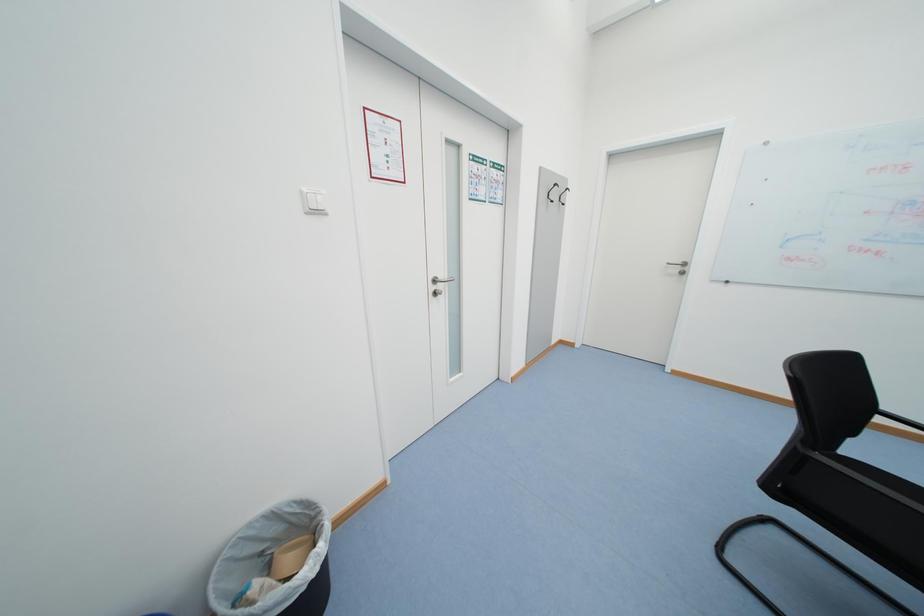
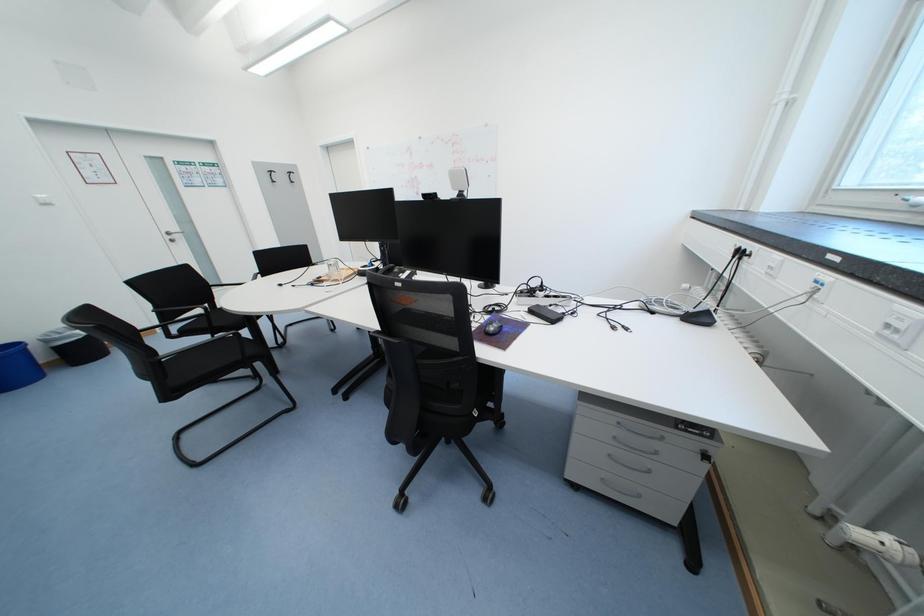
The images are taken continuously from a first-person perspective. In which direction are you moving?

The movement direction of the cameraman is right, backward.